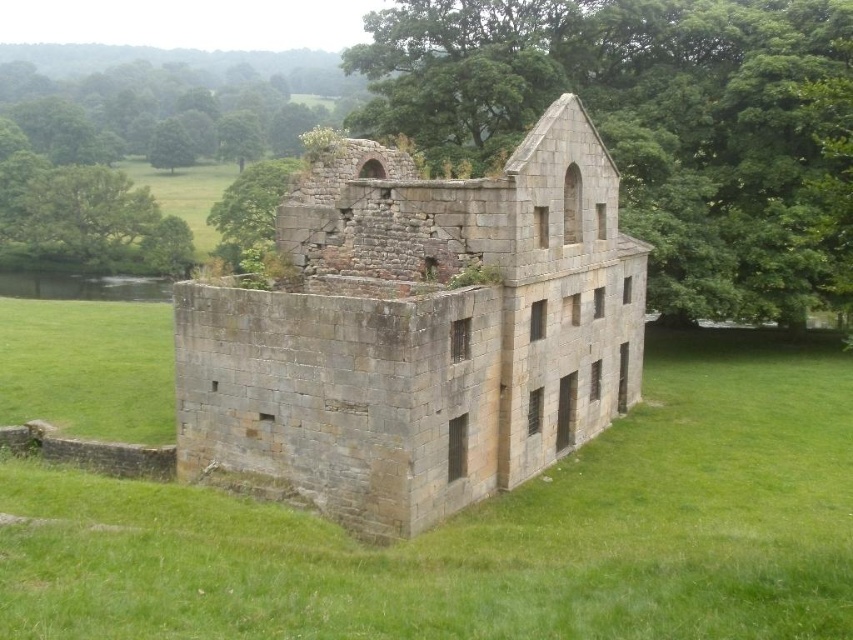
Which is above, green leafy tree at upper center or green leafy tree at upper left?

Positioned higher is green leafy tree at upper left.

Does green leafy tree at upper center have a larger size compared to green leafy tree at upper left?

No.

Locate an element on the screen. green leafy tree at upper center is located at coordinates (653, 125).

Locate an element on the screen. This screenshot has width=853, height=640. green leafy tree at upper center is located at coordinates (653, 125).

Is gray stone castle at center taller than green leafy tree at upper center?

No, gray stone castle at center is not taller than green leafy tree at upper center.

Can you confirm if gray stone castle at center is positioned above green leafy tree at upper center?

Actually, gray stone castle at center is below green leafy tree at upper center.

Who is more distant from viewer, [584,132] or [660,163]?

Positioned behind is point [660,163].

Where is `gray stone castle at center`? The width and height of the screenshot is (853, 640). gray stone castle at center is located at coordinates (416, 332).

Is green grass at center above green leafy tree at upper center?

Actually, green grass at center is below green leafy tree at upper center.

Is green grass at center positioned in front of green leafy tree at upper center?

Yes, it is.

The image size is (853, 640). Describe the element at coordinates (496, 531) in the screenshot. I see `green grass at center` at that location.

Identify the location of green grass at center. click(x=496, y=531).